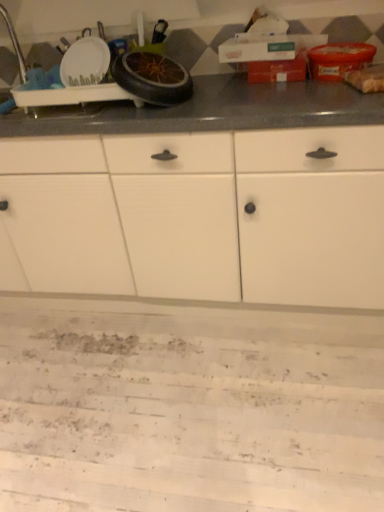
At what (x,y) coordinates should I click in order to perform the action: click on white matte cabinet at center. Please return your answer as a coordinate pair (x, y). This screenshot has width=384, height=512. Looking at the image, I should click on (200, 216).

This screenshot has width=384, height=512. What do you see at coordinates (200, 216) in the screenshot? I see `white matte cabinet at center` at bounding box center [200, 216].

In order to face white matte cabinet at center, should I rotate leftwards or rightwards?

You should look left and rotate roughly 6.317 degrees.

I want to click on white matte cabinet at center, so click(200, 216).